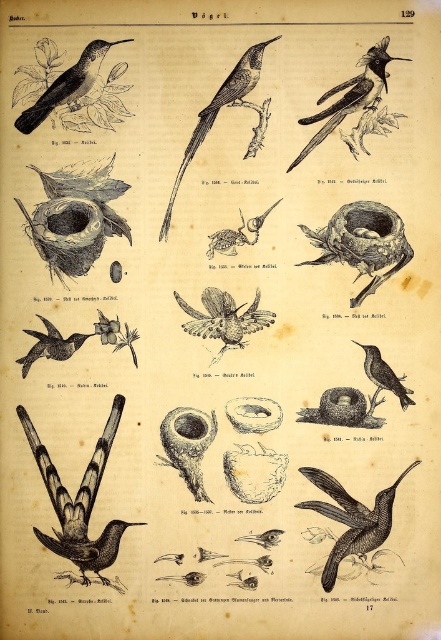
You are an ornithologist observing the birds in the botanical illustration. You notice the matte black bird at upper left and the smooth brown bird at center right. Which bird appears closer to you in the illustration?

The matte black bird at upper left appears closer because it is positioned in front of the smooth brown bird at center right.

You are an ornithologist examining the illustration. You need to compare the sizes of the black glossy hummingbird at lower left and the smooth gray bird at center. Which one is wider?

The black glossy hummingbird at lower left is wider than the smooth gray bird at center according to the description.

Looking at the botanical illustration of birds, which object is bigger between the smooth black hummingbird at lower left and the smooth gray beak at center?

The smooth black hummingbird at lower left is larger in size than the smooth gray beak at center.